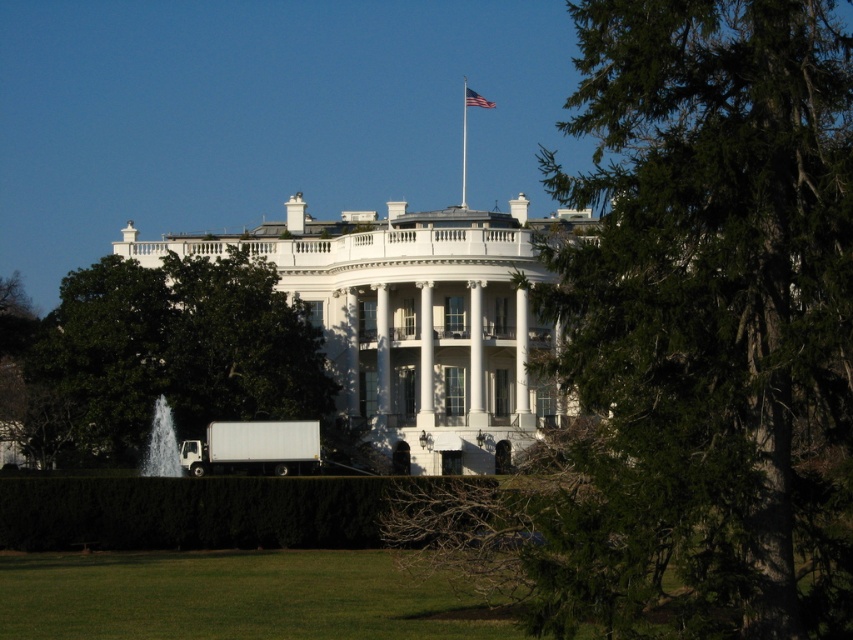
Does green leafy tree at upper right appear on the right side of green leafy hedge at lower center?

Indeed, green leafy tree at upper right is positioned on the right side of green leafy hedge at lower center.

Is green leafy tree at upper right to the left of green leafy hedge at lower center from the viewer's perspective?

In fact, green leafy tree at upper right is to the right of green leafy hedge at lower center.

Is point (787, 289) positioned before point (282, 481)?

Yes, point (787, 289) is closer to viewer.

Locate an element on the screen. This screenshot has height=640, width=853. green leafy tree at upper right is located at coordinates (689, 340).

Image resolution: width=853 pixels, height=640 pixels. Find the location of `metallic flag pole at upper center`. metallic flag pole at upper center is located at coordinates (463, 147).

Who is more forward, (x=463, y=186) or (x=463, y=104)?

Point (x=463, y=104)

Is point (463, 132) positioned behind point (492, 106)?

Yes.

You are a GUI agent. You are given a task and a screenshot of the screen. Output one action in this format:
    pyautogui.click(x=<x>, y=<y>)
    Task: Click on the metallic flag pole at upper center
    
    Given the screenshot: What is the action you would take?
    pyautogui.click(x=463, y=147)

Between green leafy tree at upper right and white glossy water at lower left, which one is positioned higher?

green leafy tree at upper right is higher up.

Is the position of green leafy tree at upper right more distant than that of white glossy water at lower left?

No, green leafy tree at upper right is in front of white glossy water at lower left.

Identify the location of green leafy tree at upper right. This screenshot has width=853, height=640. (689, 340).

Identify the location of green leafy tree at upper right. (689, 340).